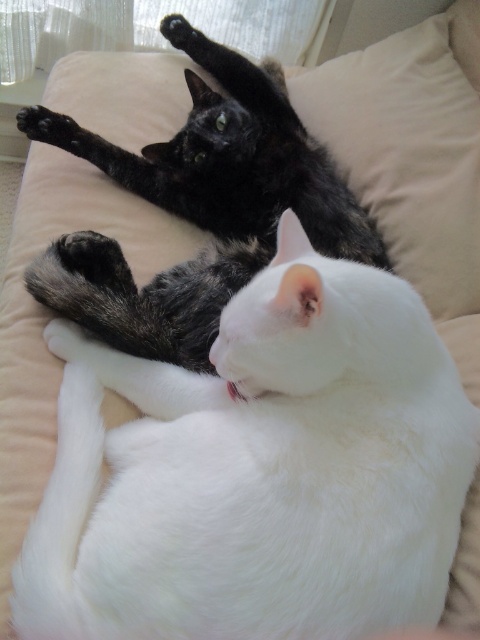
Question: Which of the following is the closest to the observer?

Choices:
 (A) black fur cat at upper center
 (B) white fluffy cat at center

Answer: (B)

Question: Is white fluffy cat at center below black fur cat at upper center?

Choices:
 (A) yes
 (B) no

Answer: (A)

Question: Does white fluffy cat at center lie behind black fur cat at upper center?

Choices:
 (A) no
 (B) yes

Answer: (A)

Question: Which point is closer to the camera taking this photo?

Choices:
 (A) [153, 280]
 (B) [60, 502]

Answer: (B)

Question: Can you confirm if white fluffy cat at center is bigger than black fur cat at upper center?

Choices:
 (A) no
 (B) yes

Answer: (A)

Question: Which of the following is the farthest from the observer?

Choices:
 (A) (216, 605)
 (B) (240, 172)

Answer: (B)